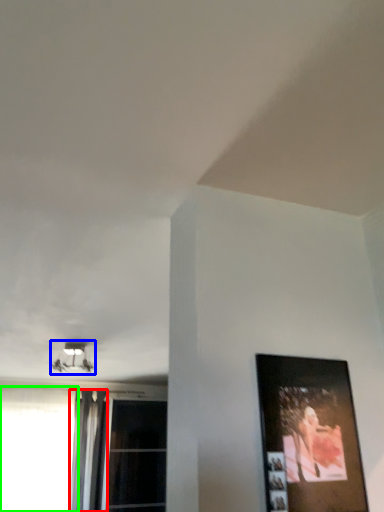
Question: Which object is the closest to the curtain (highlighted by a red box)? Choose among these: lamp (highlighted by a blue box) or window (highlighted by a green box).

Choices:
 (A) lamp
 (B) window

Answer: (B)